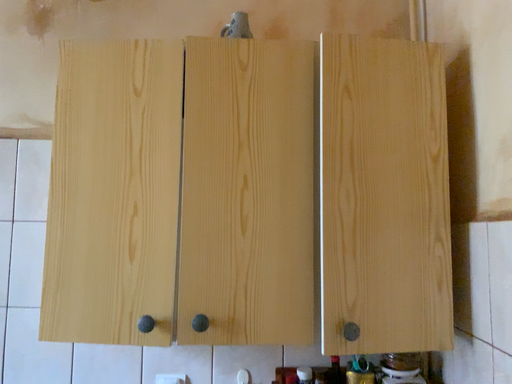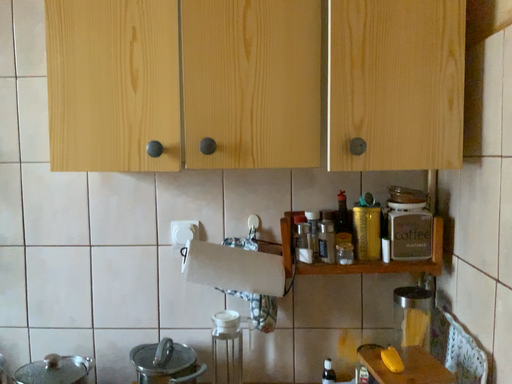
Question: Which way did the camera rotate in the video?

Choices:
 (A) rotated upward
 (B) rotated downward

Answer: (B)